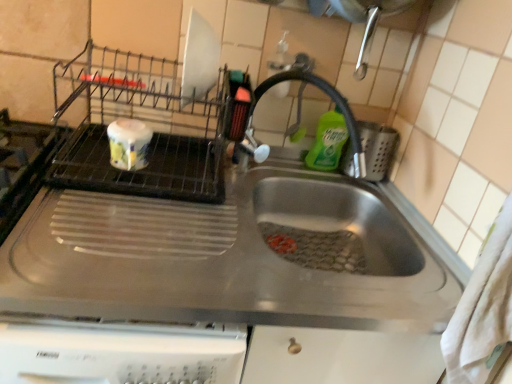
This screenshot has width=512, height=384. What do you see at coordinates (328, 141) in the screenshot?
I see `green liquid soap at upper right` at bounding box center [328, 141].

This screenshot has height=384, width=512. In order to click on satin nickel faucet at center in this screenshot , I will do `click(331, 98)`.

Where is `stainless steel sink at center`? stainless steel sink at center is located at coordinates (227, 257).

Locate an element on the screen. The width and height of the screenshot is (512, 384). green liquid soap at upper right is located at coordinates (328, 141).

From a real-world perspective, which object rests below the other?

In real-world perspective, stainless steel sink at center is lower.

Are green liquid soap at upper right and stainless steel sink at center located far from each other?

They are positioned close to each other.

Which object is more forward, green liquid soap at upper right or stainless steel sink at center?

stainless steel sink at center.

From the image's perspective, is satin nickel faucet at center located beneath stainless steel sink at center?

No.

Is satin nickel faucet at center aimed at stainless steel sink at center?

No, satin nickel faucet at center is not turned towards stainless steel sink at center.

Is satin nickel faucet at center not within stainless steel sink at center?

A: satin nickel faucet at center is positioned outside stainless steel sink at center.

In the scene shown: From the image's perspective, which one is positioned lower, satin nickel faucet at center or green liquid soap at upper right?

From the image's view, satin nickel faucet at center is below.

Can green liquid soap at upper right be found inside satin nickel faucet at center?

Yes, green liquid soap at upper right is a part of satin nickel faucet at center.

Is satin nickel faucet at center far away from green liquid soap at upper right?

No, satin nickel faucet at center is in close proximity to green liquid soap at upper right.

Which is behind, point (275, 78) or point (339, 147)?

The point (339, 147) is more distant.

Could you tell me if stainless steel sink at center is turned towards green liquid soap at upper right?

No, stainless steel sink at center is not facing towards green liquid soap at upper right.

Which is correct: stainless steel sink at center is inside green liquid soap at upper right, or outside of it?

stainless steel sink at center is not inside green liquid soap at upper right, it's outside.

How different are the orientations of stainless steel sink at center and green liquid soap at upper right in degrees?

They differ by 0.0331 degrees in their facing directions.

From the image's perspective, is green liquid soap at upper right over satin nickel faucet at center?

Yes, from the image's perspective, green liquid soap at upper right is above satin nickel faucet at center.

Would you say green liquid soap at upper right is inside or outside satin nickel faucet at center?

green liquid soap at upper right exists entirely within satin nickel faucet at center.

How different are the orientations of green liquid soap at upper right and satin nickel faucet at center in degrees?

There is a 0.000424-degree angle between the facing directions of green liquid soap at upper right and satin nickel faucet at center.

Can you confirm if green liquid soap at upper right is bigger than satin nickel faucet at center?

No.

Does stainless steel sink at center have a greater width compared to satin nickel faucet at center?

Yes.

Consider the image. Considering the relative positions of stainless steel sink at center and satin nickel faucet at center in the image provided, is stainless steel sink at center in front of satin nickel faucet at center?

Yes.

Who is bigger, stainless steel sink at center or satin nickel faucet at center?

With larger size is stainless steel sink at center.

From the image's perspective, relative to satin nickel faucet at center, is stainless steel sink at center above or below?

Clearly, from the image's perspective, stainless steel sink at center is below satin nickel faucet at center.

The image size is (512, 384). In order to click on cleaning product above the stainless steel sink at center (from a real-world perspective) in this screenshot , I will do `click(328, 141)`.

I want to click on faucet above the stainless steel sink at center (from the image's perspective), so pos(331,98).

Based on their spatial positions, is satin nickel faucet at center or green liquid soap at upper right further from stainless steel sink at center?

green liquid soap at upper right is positioned further to the anchor stainless steel sink at center.

When comparing their distances from green liquid soap at upper right, does stainless steel sink at center or satin nickel faucet at center seem further?

stainless steel sink at center lies further to green liquid soap at upper right than the other object.

When comparing their distances from stainless steel sink at center, does green liquid soap at upper right or satin nickel faucet at center seem further?

green liquid soap at upper right.

Which object lies nearer to the anchor point satin nickel faucet at center, stainless steel sink at center or green liquid soap at upper right?

green liquid soap at upper right is positioned closer to the anchor satin nickel faucet at center.

Which object lies nearer to the anchor point satin nickel faucet at center, green liquid soap at upper right or stainless steel sink at center?

green liquid soap at upper right.

Based on their spatial positions, is satin nickel faucet at center or stainless steel sink at center closer to green liquid soap at upper right?

satin nickel faucet at center is positioned closer to the anchor green liquid soap at upper right.

This screenshot has width=512, height=384. I want to click on faucet between stainless steel sink at center and green liquid soap at upper right in the front-back direction, so click(331, 98).